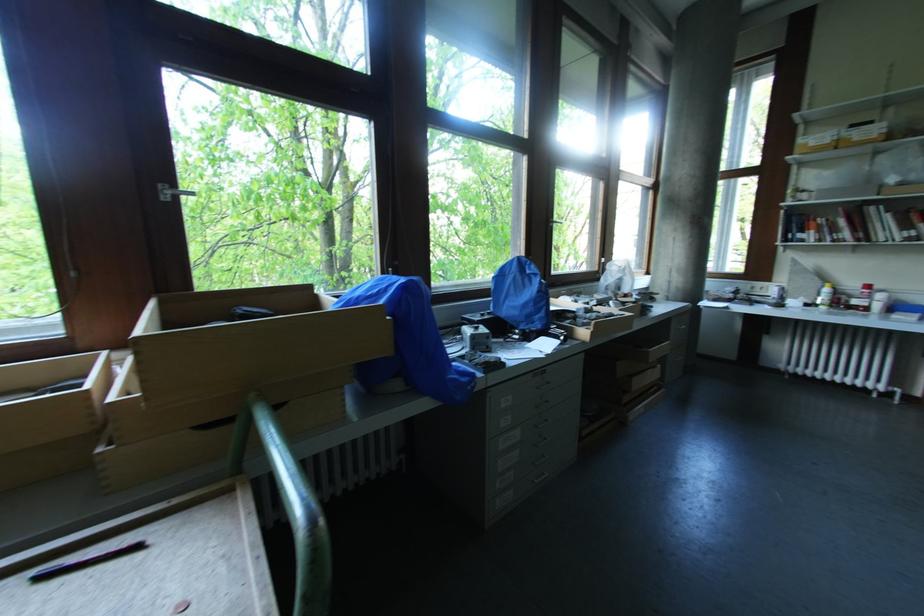
The width and height of the screenshot is (924, 616). I want to click on drawer handle, so click(x=541, y=386).